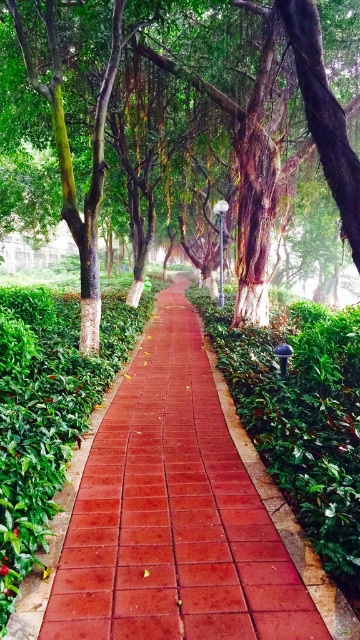
Question: Which point is closer to the camera taking this photo?

Choices:
 (A) (104, 452)
 (B) (257, 243)

Answer: (A)

Question: Where is red brick path at center located in relation to green matte tree at center in the image?

Choices:
 (A) right
 (B) left

Answer: (A)

Question: Can you confirm if red brick path at center is bigger than green matte tree at center?

Choices:
 (A) yes
 (B) no

Answer: (B)

Question: Considering the relative positions of red brick path at center and green matte tree at center in the image provided, where is red brick path at center located with respect to green matte tree at center?

Choices:
 (A) right
 (B) left

Answer: (A)

Question: Which point appears closest to the camera in this image?

Choices:
 (A) (194, 76)
 (B) (128, 602)

Answer: (B)